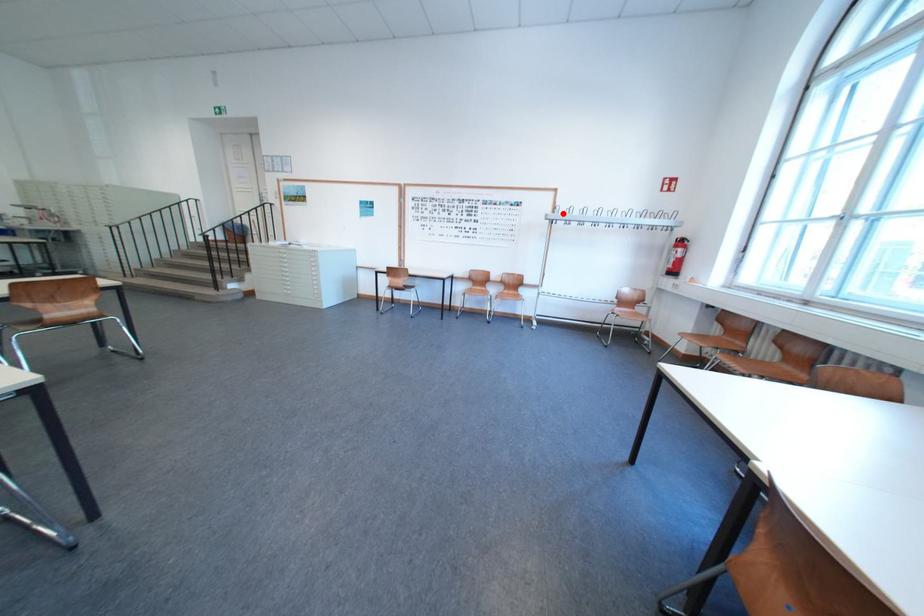
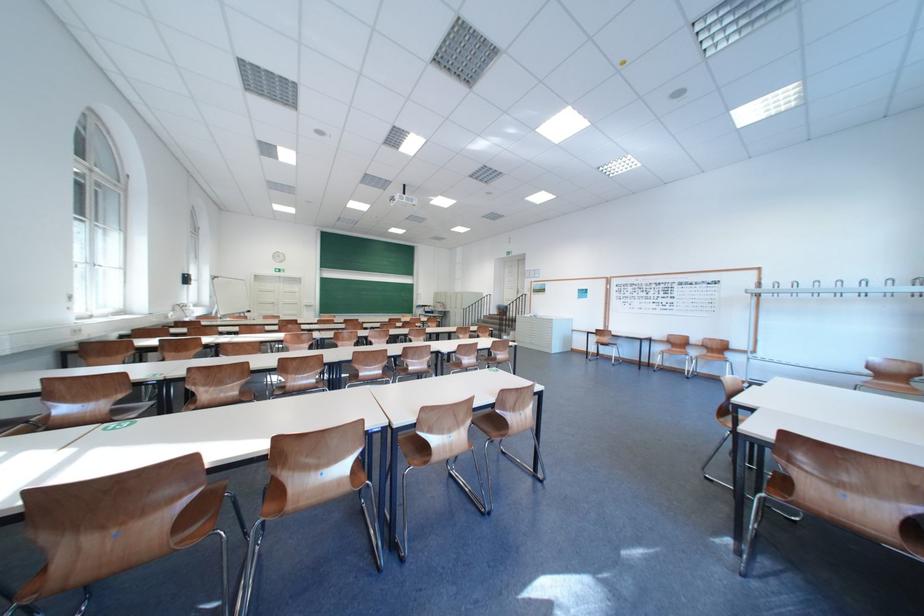
The point at the highlighted location is marked in the first image. Where is the corresponding point in the second image?

(767, 288)